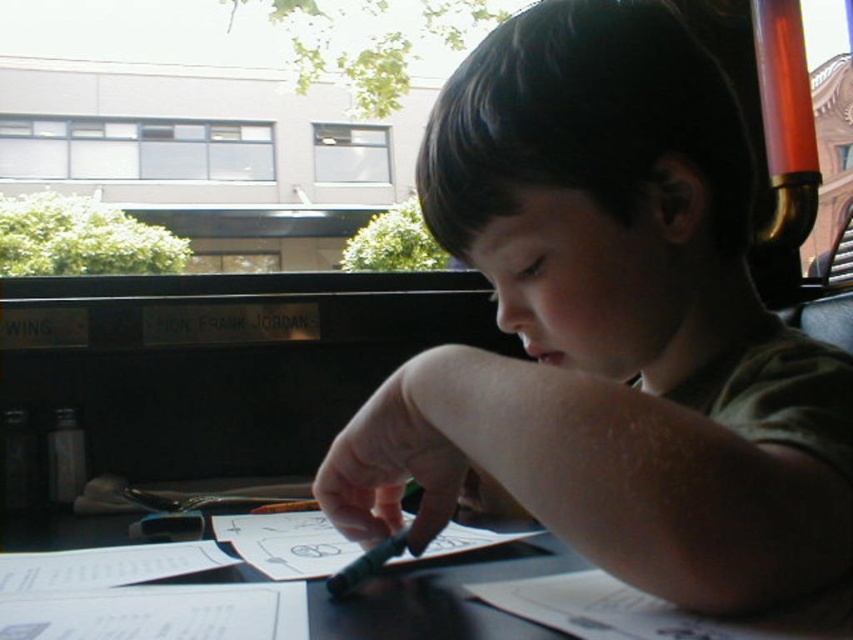
Does matte green crayon at center appear over black paper at center?

Yes, matte green crayon at center is above black paper at center.

Is matte green crayon at center wider than black paper at center?

In fact, matte green crayon at center might be narrower than black paper at center.

Which is in front, point (392, 472) or point (432, 588)?

Positioned in front is point (392, 472).

Where is `matte green crayon at center`? This screenshot has width=853, height=640. matte green crayon at center is located at coordinates (610, 328).